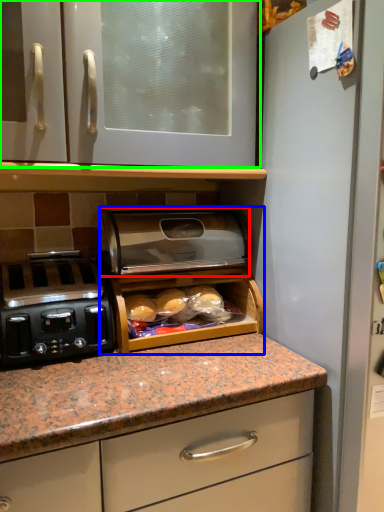
Question: Estimate the real-world distances between objects in this image. Which object is farther from appliance (highlighted by a red box), appliance (highlighted by a blue box) or cabinetry (highlighted by a green box)?

Choices:
 (A) appliance
 (B) cabinetry

Answer: (B)